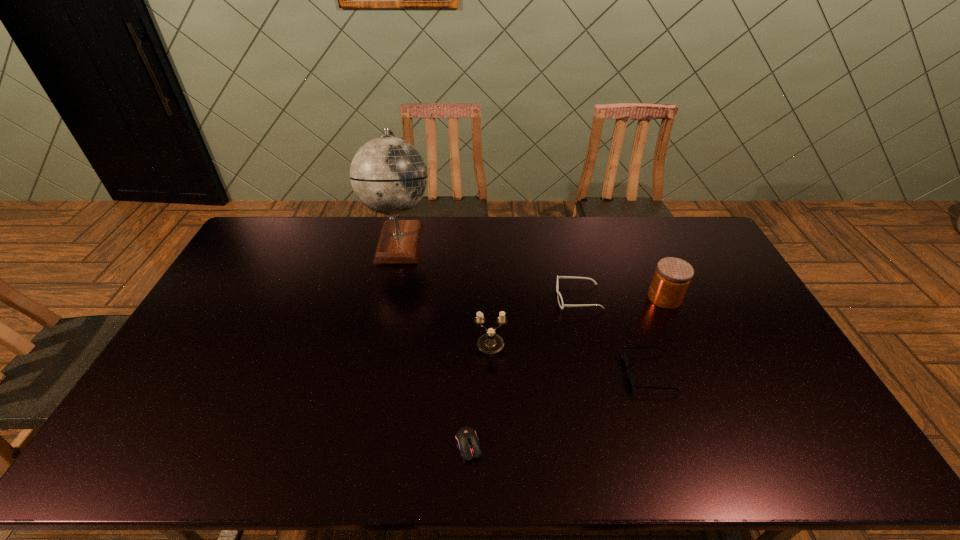
Find the location of a particular element. object that is at the near edge is located at coordinates (467, 441).

I want to click on vacant space at the far edge of the desktop, so click(491, 228).

In the image, there is a desktop. Find the location of `vacant space at the near edge`. vacant space at the near edge is located at coordinates (692, 438).

The image size is (960, 540). In the image, there is a desktop. Identify the location of vacant space at the right edge. (775, 393).

This screenshot has width=960, height=540. I want to click on vacant space that is in between the left sunglasses and the candle holder, so click(535, 321).

Locate an element on the screen. This screenshot has width=960, height=540. free space between the second object from right to left and the candle holder is located at coordinates (570, 359).

Image resolution: width=960 pixels, height=540 pixels. Find the location of `vacant area between the fifth object from left to right and the candle holder`. vacant area between the fifth object from left to right and the candle holder is located at coordinates (570, 359).

Locate an element on the screen. vacant area between the candle holder and the third object from right to left is located at coordinates (535, 321).

In order to click on unoccupied position between the leftmost object and the candle holder in this screenshot , I will do `click(445, 293)`.

Locate an element on the screen. This screenshot has height=540, width=960. vacant region between the nearest object and the candle holder is located at coordinates (480, 395).